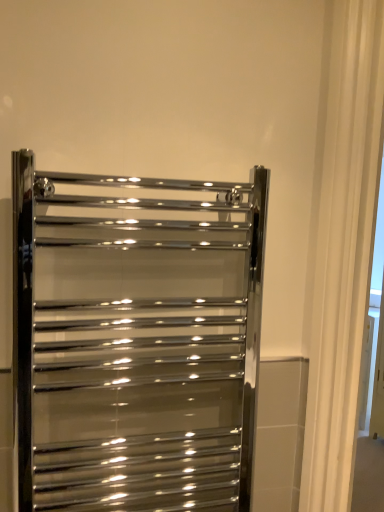
Question: Should I look upward or downward to see polished chrome towel rack at center?

Choices:
 (A) down
 (B) up

Answer: (A)